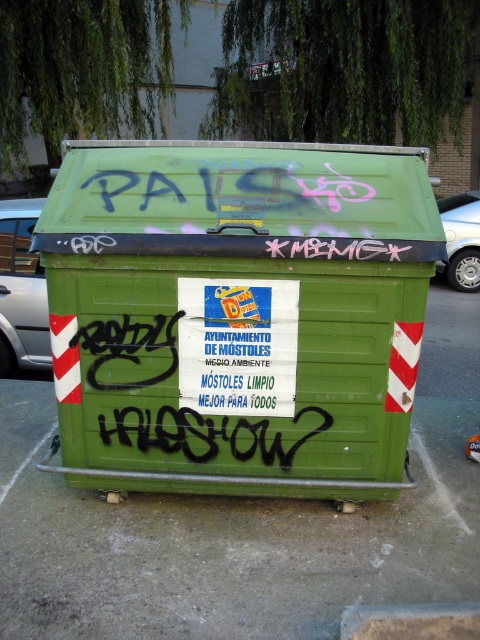
Who is shorter, silver metallic car at left or silver metallic car at right?

silver metallic car at left is shorter.

Between silver metallic car at left and silver metallic car at right, which one is positioned lower?

silver metallic car at left is below.

Describe the element at coordinates (22, 291) in the screenshot. The height and width of the screenshot is (640, 480). I see `silver metallic car at left` at that location.

Where is `silver metallic car at left`? This screenshot has height=640, width=480. silver metallic car at left is located at coordinates (22, 291).

Between green matte recycling bin at center and silver metallic car at left, which one appears on the right side from the viewer's perspective?

From the viewer's perspective, green matte recycling bin at center appears more on the right side.

Based on the photo, can you confirm if green matte recycling bin at center is bigger than silver metallic car at left?

Correct, green matte recycling bin at center is larger in size than silver metallic car at left.

Is point (391, 365) positioned after point (45, 365)?

No, (391, 365) is in front of (45, 365).

I want to click on green matte recycling bin at center, so click(x=237, y=314).

Who is positioned more to the right, green matte recycling bin at center or silver metallic car at right?

From the viewer's perspective, silver metallic car at right appears more on the right side.

Can you confirm if green matte recycling bin at center is wider than silver metallic car at right?

Indeed, green matte recycling bin at center has a greater width compared to silver metallic car at right.

Who is more forward, (367,324) or (454,218)?

Positioned in front is point (367,324).

The height and width of the screenshot is (640, 480). Identify the location of green matte recycling bin at center. (237, 314).